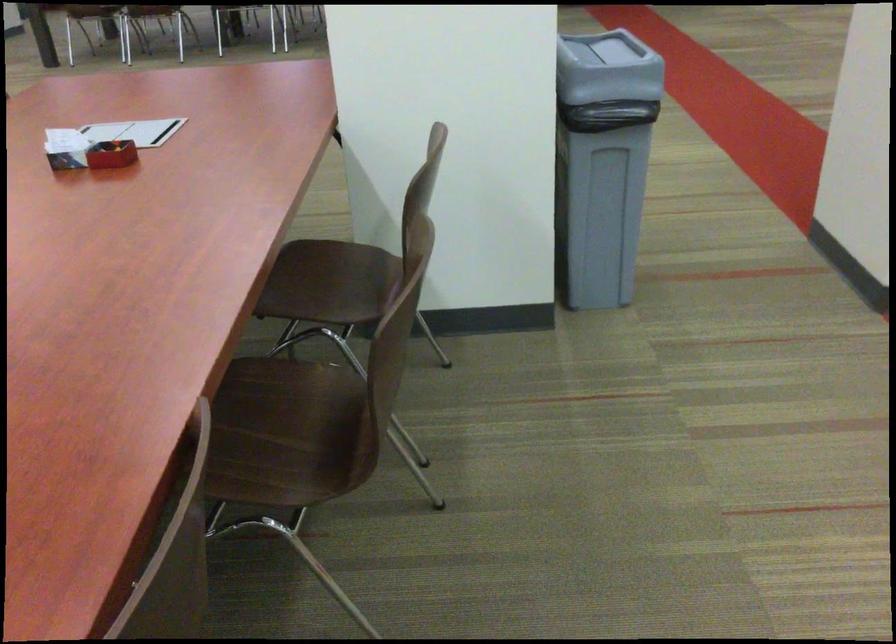
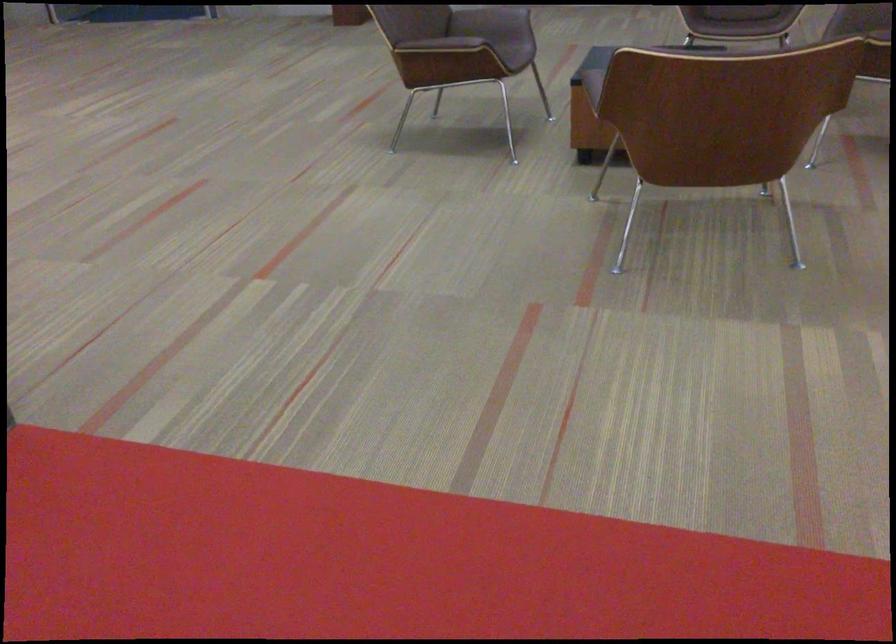
Based on the continuous images, in which direction is the camera rotating?

The camera rotated toward right-down.